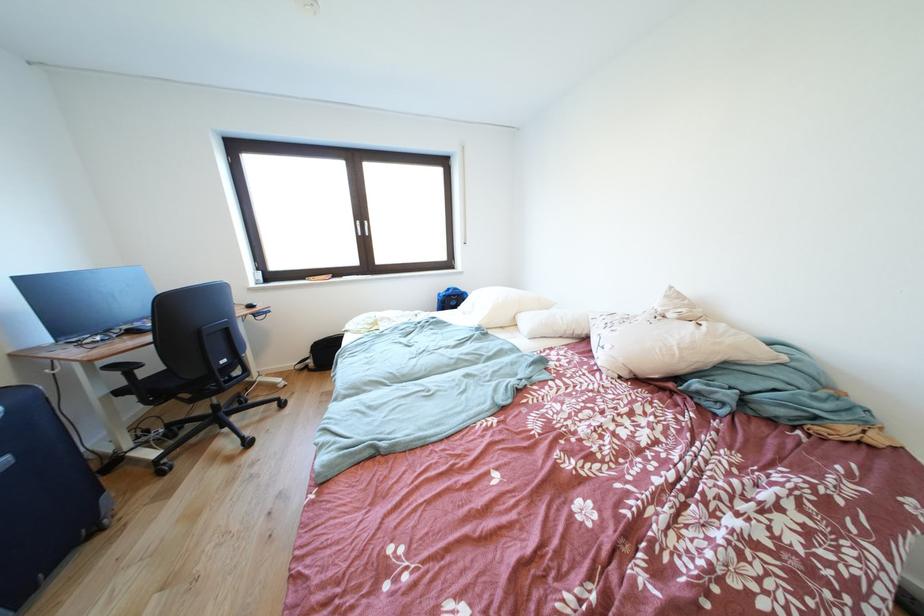
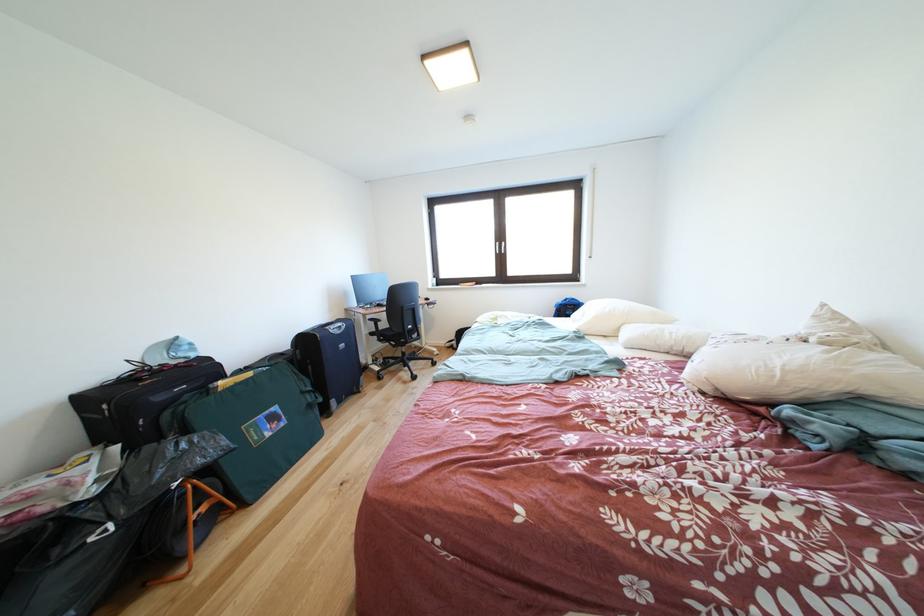
Locate, in the second image, the point that corresponds to [634,379] in the first image.

(716, 394)